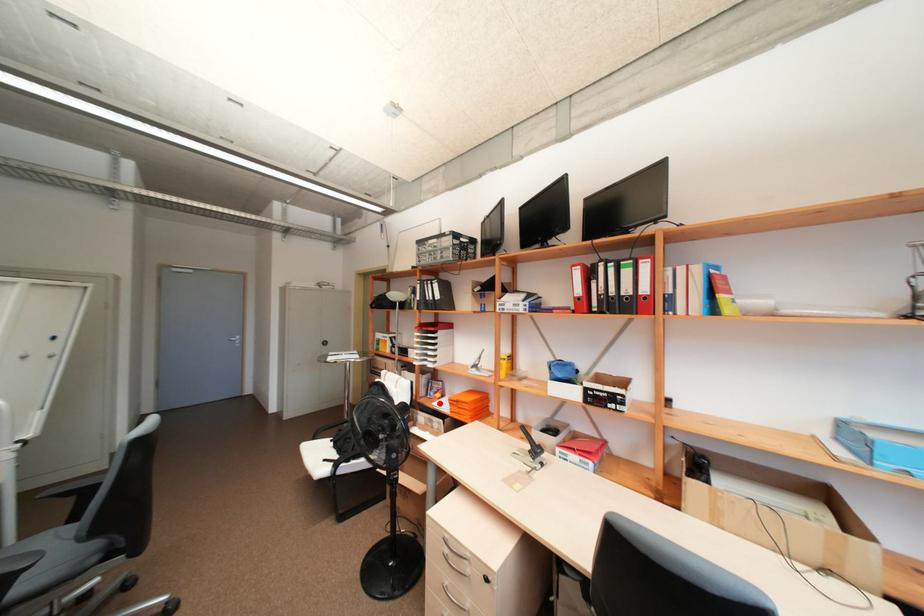
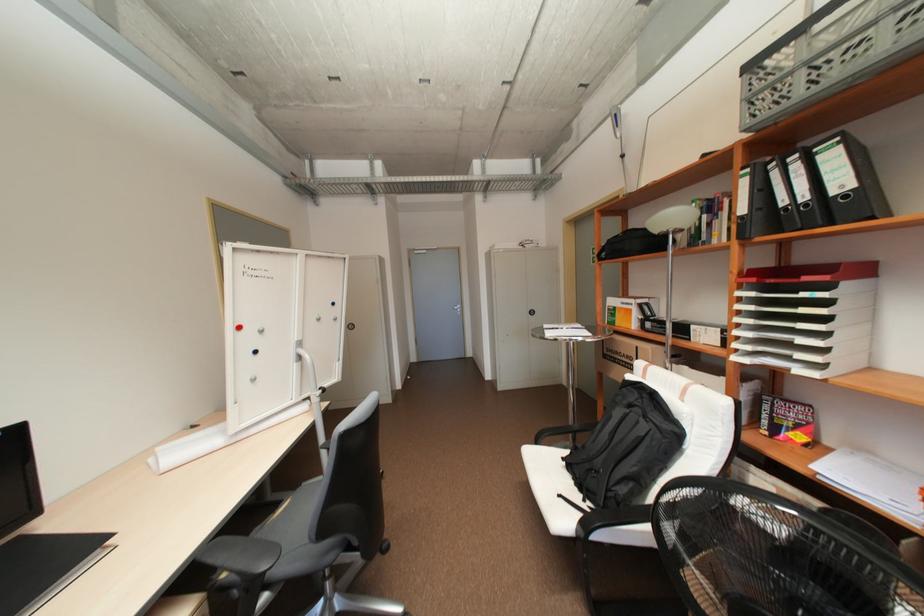
The point at the highlighted location is marked in the first image. Where is the corresponding point in the second image?

(820, 467)